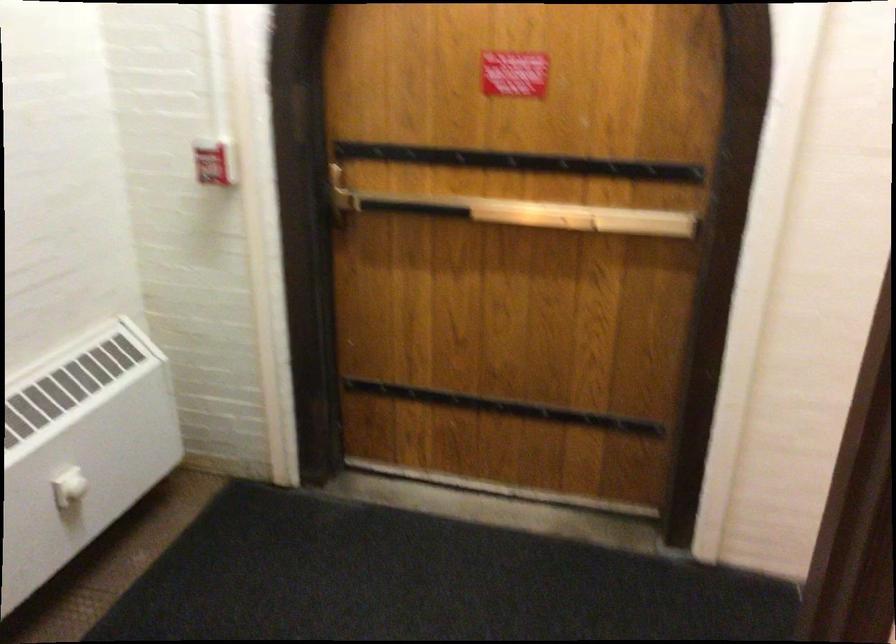
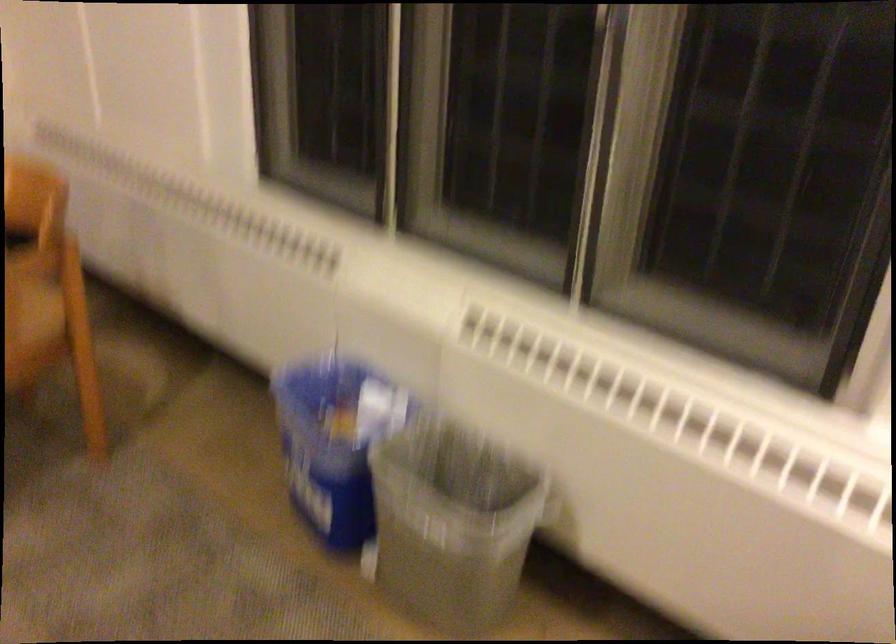
What movement of the cameraman would produce the second image?

The movement direction of the cameraman is left, forward.